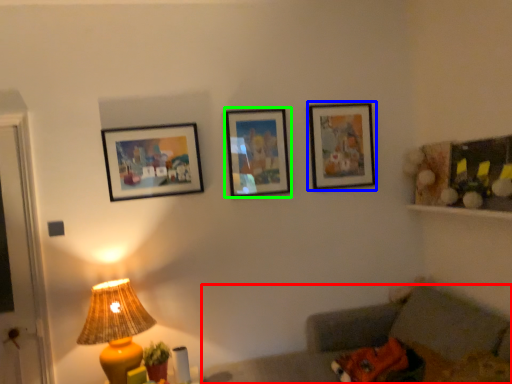
Question: Estimate the real-world distances between objects in this image. Which object is farther from couch (highlighted by a red box), picture frame (highlighted by a blue box) or picture frame (highlighted by a green box)?

Choices:
 (A) picture frame
 (B) picture frame

Answer: (B)